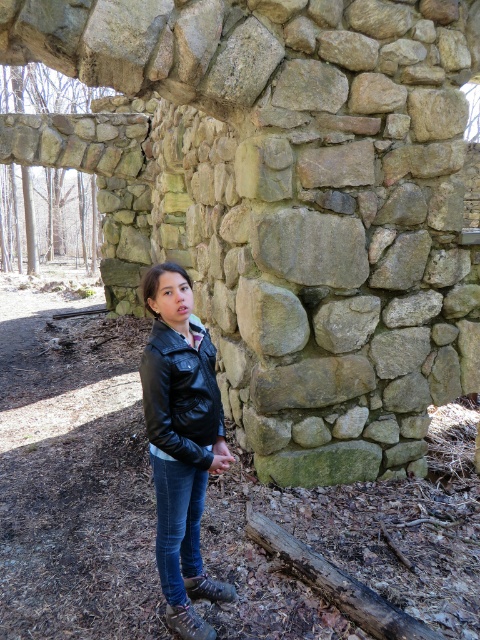
You are a photographer trying to capture the black leather jacket at center and the black leather jacket at lower left in the same frame. Which one will appear closer to you in the photo?

The black leather jacket at center will appear closer to you because it is in front of the black leather jacket at lower left, which is behind it.

In the scene shown: You are an archaeologist examining the clothing items in the scene. Which clothing item, the black leather jacket at lower left or the denim at lower center, is positioned higher relative to the ground?

The black leather jacket at lower left is located above denim at lower center, so it is positioned higher relative to the ground.